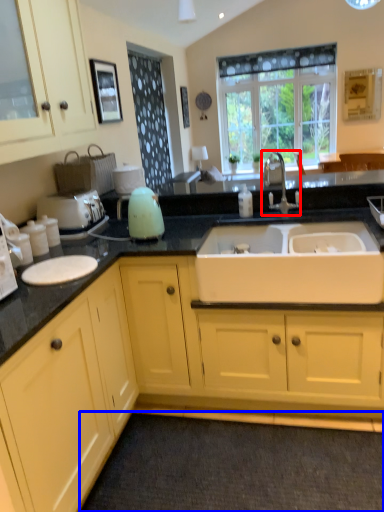
Question: Which object appears closest to the camera in this image, tap (highlighted by a red box) or plain (highlighted by a blue box)?

Choices:
 (A) tap
 (B) plain

Answer: (B)